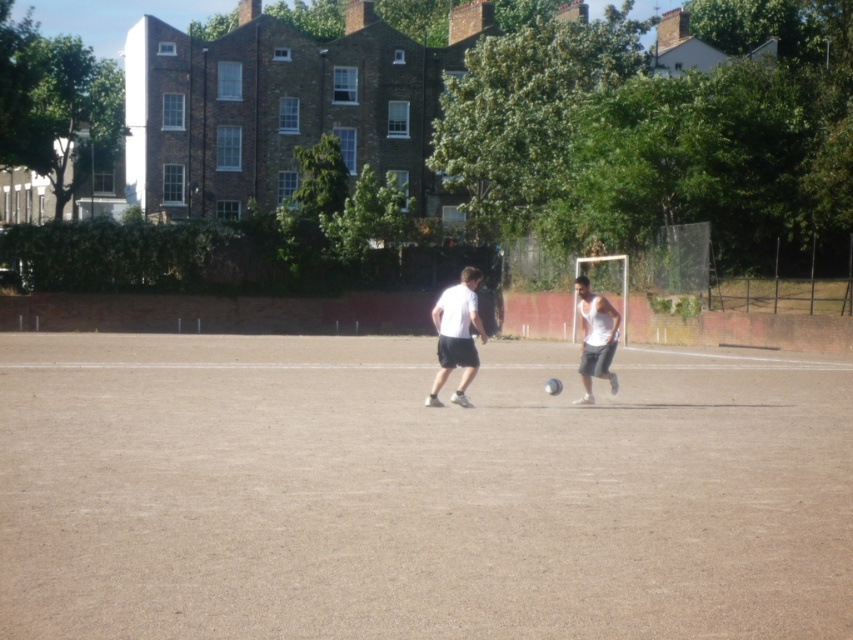
You are a photographer trying to capture a wide shot of the soccer game. You notice the brown textured ground at center and the white matte tank top at center. Which object would appear wider in the photo?

The brown textured ground at center would appear wider in the photo because its width surpasses that of the white matte tank top at center.

You are a photographer trying to capture a closeup of the soccer ball. You notice the brown textured ground at center and the white matte tank top at center are both in the frame. Which object should you focus on to ensure the soccer ball is clearly visible?

The brown textured ground at center is larger in size than the white matte tank top at center. To ensure the soccer ball is clearly visible, focus on the brown textured ground at center since it occupies more space in the frame, providing a stable background.